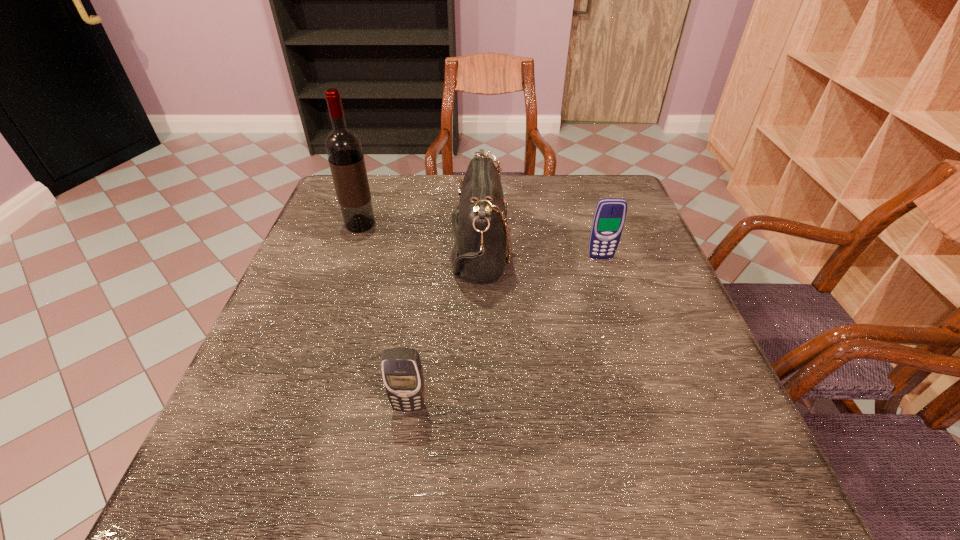
What are the coordinates of `vacant space situated 0.200m on the front-facing side of the right cellular telephone` in the screenshot? It's located at (621, 321).

You are a GUI agent. You are given a task and a screenshot of the screen. Output one action in this format:
    pyautogui.click(x=<x>, y=<y>)
    Task: Click on the vacant space located on the front face of the third object from right to left
    
    Given the screenshot: What is the action you would take?
    (x=398, y=485)

At what (x,y) coordinates should I click in order to perform the action: click on wine bottle present at the far edge. Please return your answer as a coordinate pair (x, y). Looking at the image, I should click on (343, 147).

Image resolution: width=960 pixels, height=540 pixels. Identify the location of handbag present at the far edge. (481, 235).

The height and width of the screenshot is (540, 960). In order to click on object that is at the left edge in this screenshot , I will do `click(343, 147)`.

Find the location of a particular element. The height and width of the screenshot is (540, 960). object at the right edge is located at coordinates (609, 218).

Identify the location of object at the far left corner. This screenshot has height=540, width=960. (343, 147).

Find the location of a particular element. vacant space at the far edge is located at coordinates (528, 209).

In the image, there is a desktop. At what (x,y) coordinates should I click in order to perform the action: click on free space at the near edge. Please return your answer as a coordinate pair (x, y). Looking at the image, I should click on (505, 493).

Locate an element on the screen. This screenshot has width=960, height=540. vacant space at the left edge of the desktop is located at coordinates (243, 386).